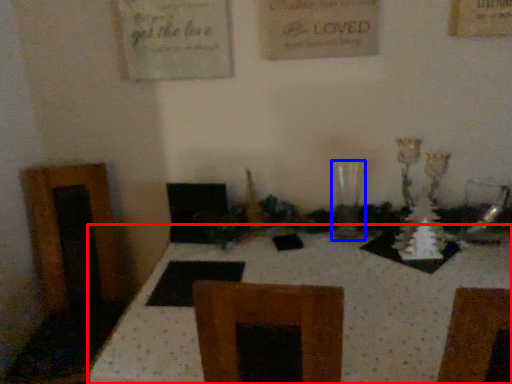
Question: Which point is further to the camera, table (highlighted by a red box) or glass vase (highlighted by a blue box)?

Choices:
 (A) table
 (B) glass vase

Answer: (B)